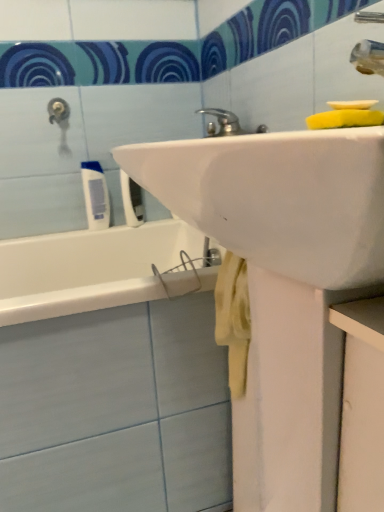
Where is `white matte tube at left, placed as the second toiletry when sorted from right to left`? white matte tube at left, placed as the second toiletry when sorted from right to left is located at coordinates (x=95, y=195).

Where is `yellow sponge at upper right`? The height and width of the screenshot is (512, 384). yellow sponge at upper right is located at coordinates (345, 119).

Identify the location of toiletry below the white plastic toothbrush at upper left, which is the 1th toiletry in right-to-left order (from a real-world perspective). This screenshot has width=384, height=512. (95, 195).

Is white matte tube at left, positioned as the first toiletry in left-to-right order, taller than white plastic toothbrush at upper left, the 2th toiletry in the left-to-right sequence?

Incorrect, the height of white matte tube at left, positioned as the first toiletry in left-to-right order, is not larger of that of white plastic toothbrush at upper left, the 2th toiletry in the left-to-right sequence.

Is white matte tube at left, placed as the second toiletry when sorted from right to left, oriented away from white plastic toothbrush at upper left, which is the 1th toiletry in right-to-left order?

No, white plastic toothbrush at upper left, which is the 1th toiletry in right-to-left order, is not at the back of white matte tube at left, placed as the second toiletry when sorted from right to left.

Looking at this image, is white matte tube at left, placed as the second toiletry when sorted from right to left, with white plastic toothbrush at upper left, which is the 1th toiletry in right-to-left order?

Yes, the surface of white matte tube at left, placed as the second toiletry when sorted from right to left, is in contact with white plastic toothbrush at upper left, which is the 1th toiletry in right-to-left order.

Is yellow sponge at upper right thinner than white plastic toothbrush at upper left, which is the 1th toiletry in right-to-left order?

Incorrect, the width of yellow sponge at upper right is not less than that of white plastic toothbrush at upper left, which is the 1th toiletry in right-to-left order.

Which is more to the left, yellow sponge at upper right or white plastic toothbrush at upper left, the 2th toiletry in the left-to-right sequence?

From the viewer's perspective, white plastic toothbrush at upper left, the 2th toiletry in the left-to-right sequence, appears more on the left side.

What's the angular difference between yellow sponge at upper right and white plastic toothbrush at upper left, the 2th toiletry in the left-to-right sequence,'s facing directions?

The angle between the facing direction of yellow sponge at upper right and the facing direction of white plastic toothbrush at upper left, the 2th toiletry in the left-to-right sequence, is 46 degrees.

Looking at this image, which object is more forward, yellow sponge at upper right or white plastic toothbrush at upper left, which is the 1th toiletry in right-to-left order?

Positioned in front is yellow sponge at upper right.

In order to click on the 1st toiletry behind the yellow sponge at upper right, starting your count from the anchor in this screenshot , I will do `click(95, 195)`.

Considering the points (84, 162) and (333, 118), which point is in front, point (84, 162) or point (333, 118)?

Point (333, 118)

How many degrees apart are the facing directions of white matte tube at left, positioned as the first toiletry in left-to-right order, and yellow sponge at upper right?

The facing directions of white matte tube at left, positioned as the first toiletry in left-to-right order, and yellow sponge at upper right are 82.2 degrees apart.

How much distance is there between white plastic toothbrush at upper left, the 2th toiletry in the left-to-right sequence, and yellow sponge at upper right?

A distance of 29.50 inches exists between white plastic toothbrush at upper left, the 2th toiletry in the left-to-right sequence, and yellow sponge at upper right.

Is white plastic toothbrush at upper left, which is the 1th toiletry in right-to-left order, facing away from yellow sponge at upper right?

That's not correct — white plastic toothbrush at upper left, which is the 1th toiletry in right-to-left order, is not looking away from yellow sponge at upper right.

Is point (124, 188) positioned in front of point (377, 124)?

No, (124, 188) is further to viewer.

Starting from the yellow sponge at upper right, which toiletry is the 1st one to the left? Please provide its 2D coordinates.

[(132, 201)]

Can you confirm if white plastic toothbrush at upper left, the 2th toiletry in the left-to-right sequence, is positioned to the right of white matte tube at left, positioned as the first toiletry in left-to-right order?

Yes, white plastic toothbrush at upper left, the 2th toiletry in the left-to-right sequence, is to the right of white matte tube at left, positioned as the first toiletry in left-to-right order.

Relative to white matte tube at left, positioned as the first toiletry in left-to-right order, is white plastic toothbrush at upper left, which is the 1th toiletry in right-to-left order, in front or behind?

Visually, white plastic toothbrush at upper left, which is the 1th toiletry in right-to-left order, is located behind white matte tube at left, positioned as the first toiletry in left-to-right order.

Considering the sizes of objects white plastic toothbrush at upper left, the 2th toiletry in the left-to-right sequence, and white matte tube at left, placed as the second toiletry when sorted from right to left, in the image provided, who is shorter, white plastic toothbrush at upper left, the 2th toiletry in the left-to-right sequence, or white matte tube at left, placed as the second toiletry when sorted from right to left,?

With less height is white matte tube at left, placed as the second toiletry when sorted from right to left.

From a real-world perspective, is white plastic toothbrush at upper left, the 2th toiletry in the left-to-right sequence, on top of white matte tube at left, placed as the second toiletry when sorted from right to left?

Yes, from a real-world perspective, white plastic toothbrush at upper left, the 2th toiletry in the left-to-right sequence, is over white matte tube at left, placed as the second toiletry when sorted from right to left

In the scene shown: Can you confirm if yellow sponge at upper right is positioned to the left of white matte tube at left, positioned as the first toiletry in left-to-right order?

In fact, yellow sponge at upper right is to the right of white matte tube at left, positioned as the first toiletry in left-to-right order.

Is yellow sponge at upper right taller than white matte tube at left, placed as the second toiletry when sorted from right to left?

Incorrect, the height of yellow sponge at upper right is not larger of that of white matte tube at left, placed as the second toiletry when sorted from right to left.

Identify the location of toiletry below the white plastic toothbrush at upper left, the 2th toiletry in the left-to-right sequence (from a real-world perspective). (95, 195).

Find the location of a particular element. soap on the right of white plastic toothbrush at upper left, the 2th toiletry in the left-to-right sequence is located at coordinates (345, 119).

When comparing their distances from yellow sponge at upper right, does white matte tube at left, placed as the second toiletry when sorted from right to left, or white plastic toothbrush at upper left, which is the 1th toiletry in right-to-left order, seem closer?

white plastic toothbrush at upper left, which is the 1th toiletry in right-to-left order.

Which object lies further to the anchor point white matte tube at left, placed as the second toiletry when sorted from right to left, yellow sponge at upper right or white plastic toothbrush at upper left, the 2th toiletry in the left-to-right sequence?

Based on the image, yellow sponge at upper right appears to be further to white matte tube at left, placed as the second toiletry when sorted from right to left.

Looking at the image, which one is located further to white matte tube at left, placed as the second toiletry when sorted from right to left, white plastic toothbrush at upper left, which is the 1th toiletry in right-to-left order, or yellow sponge at upper right?

yellow sponge at upper right lies further to white matte tube at left, placed as the second toiletry when sorted from right to left, than the other object.

Which object lies nearer to the anchor point white plastic toothbrush at upper left, which is the 1th toiletry in right-to-left order, white matte tube at left, positioned as the first toiletry in left-to-right order, or yellow sponge at upper right?

Based on the image, white matte tube at left, positioned as the first toiletry in left-to-right order, appears to be nearer to white plastic toothbrush at upper left, which is the 1th toiletry in right-to-left order.

Estimate the real-world distances between objects in this image. Which object is further from white plastic toothbrush at upper left, the 2th toiletry in the left-to-right sequence, yellow sponge at upper right or white matte tube at left, placed as the second toiletry when sorted from right to left?

yellow sponge at upper right.

Looking at the image, which one is located closer to yellow sponge at upper right, white plastic toothbrush at upper left, which is the 1th toiletry in right-to-left order, or white matte tube at left, placed as the second toiletry when sorted from right to left?

The object closer to yellow sponge at upper right is white plastic toothbrush at upper left, which is the 1th toiletry in right-to-left order.

Where is `toiletry between yellow sponge at upper right and white plastic toothbrush at upper left, which is the 1th toiletry in right-to-left order, along the z-axis`? The height and width of the screenshot is (512, 384). toiletry between yellow sponge at upper right and white plastic toothbrush at upper left, which is the 1th toiletry in right-to-left order, along the z-axis is located at coordinates (95, 195).